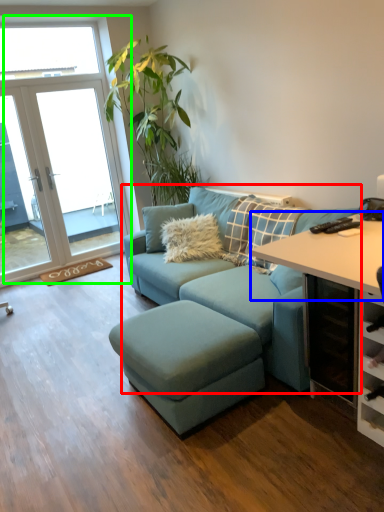
Question: Considering the real-world distances, which object is closest to studio couch (highlighted by a red box)? table (highlighted by a blue box) or window (highlighted by a green box).

Choices:
 (A) table
 (B) window

Answer: (A)